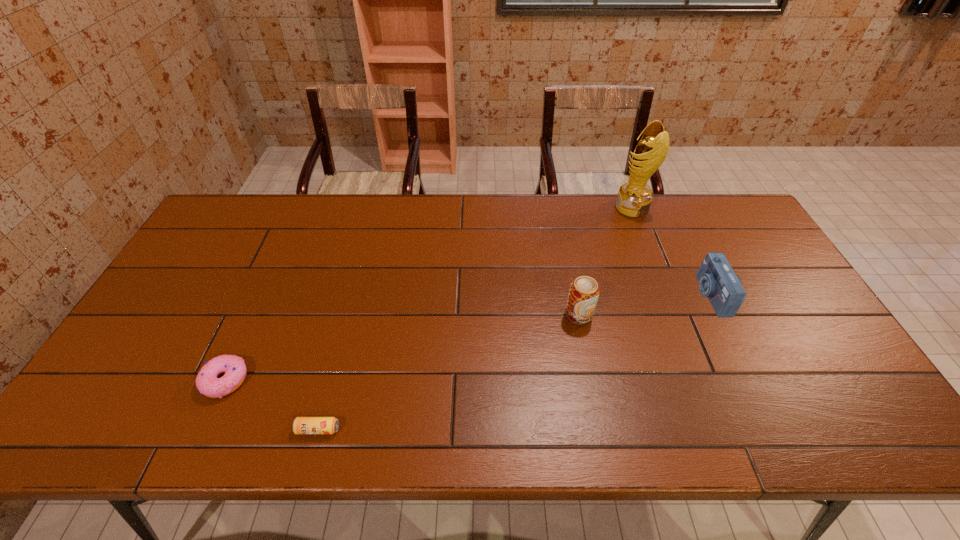
Locate an element on the screen. vacant space that satisfies the following two spatial constraints: 1. on the front-facing side of the award; 2. on the front side of the second shortest object is located at coordinates (700, 380).

Identify the location of free spot that satisfies the following two spatial constraints: 1. on the front-facing side of the farthest object; 2. on the front side of the doughnut. The height and width of the screenshot is (540, 960). (700, 380).

Identify the location of free location that satisfies the following two spatial constraints: 1. on the back side of the fourth tallest object; 2. on the right side of the farther beer can. Image resolution: width=960 pixels, height=540 pixels. (x=255, y=315).